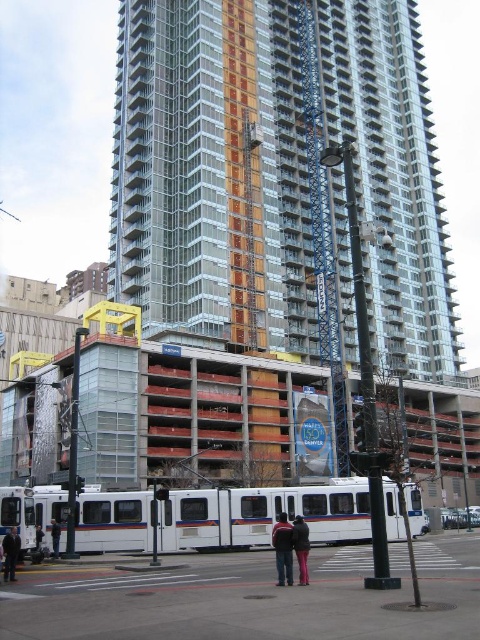
Question: Which object is farther from the camera taking this photo?

Choices:
 (A) dark blue jeans at center
 (B) matte black jacket at center

Answer: (B)

Question: Based on their relative distances, which object is farther from the dark blue jeans at center?

Choices:
 (A) clear glass building at center
 (B) white fabric jacket at lower left

Answer: (A)

Question: Is clear glass building at center in front of white fabric jacket at lower left?

Choices:
 (A) no
 (B) yes

Answer: (A)

Question: Which point appears closest to the camera in this image?

Choices:
 (A) (201, 310)
 (B) (283, 554)
 (C) (54, 556)
 (D) (307, 573)

Answer: (B)

Question: Observing the image, what is the correct spatial positioning of white matte passenger train at center in reference to matte black jacket at center?

Choices:
 (A) right
 (B) left

Answer: (B)

Question: In this image, where is white matte passenger train at center located relative to dark blue jeans at center?

Choices:
 (A) above
 (B) below

Answer: (B)